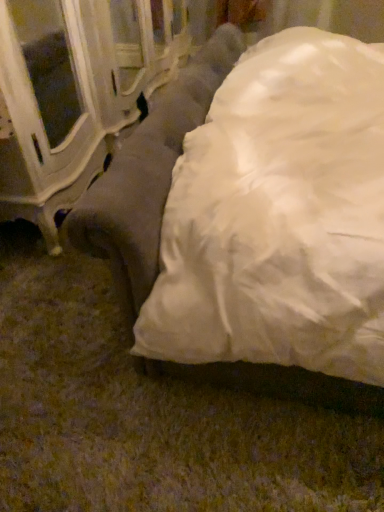
Question: Considering their positions, is white glossy cabinet at left located in front of or behind suede-like gray couch at center?

Choices:
 (A) behind
 (B) front

Answer: (A)

Question: Looking at the image, does white glossy cabinet at left seem bigger or smaller compared to suede-like gray couch at center?

Choices:
 (A) big
 (B) small

Answer: (B)

Question: Is point (31, 212) positioned closer to the camera than point (72, 236)?

Choices:
 (A) farther
 (B) closer

Answer: (A)

Question: Is suede-like gray couch at center wider or thinner than white glossy cabinet at left?

Choices:
 (A) wide
 (B) thin

Answer: (A)

Question: From the image's perspective, is suede-like gray couch at center above or below white glossy cabinet at left?

Choices:
 (A) above
 (B) below

Answer: (B)

Question: Does point (220, 54) appear closer or farther from the camera than point (66, 186)?

Choices:
 (A) farther
 (B) closer

Answer: (A)

Question: Relative to white glossy cabinet at left, is suede-like gray couch at center in front or behind?

Choices:
 (A) behind
 (B) front

Answer: (B)